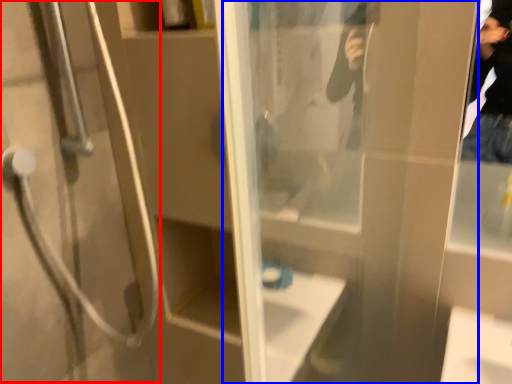
Question: Among these objects, which one is nearest to the camera, shower door (highlighted by a red box) or screen door (highlighted by a blue box)?

Choices:
 (A) shower door
 (B) screen door

Answer: (B)